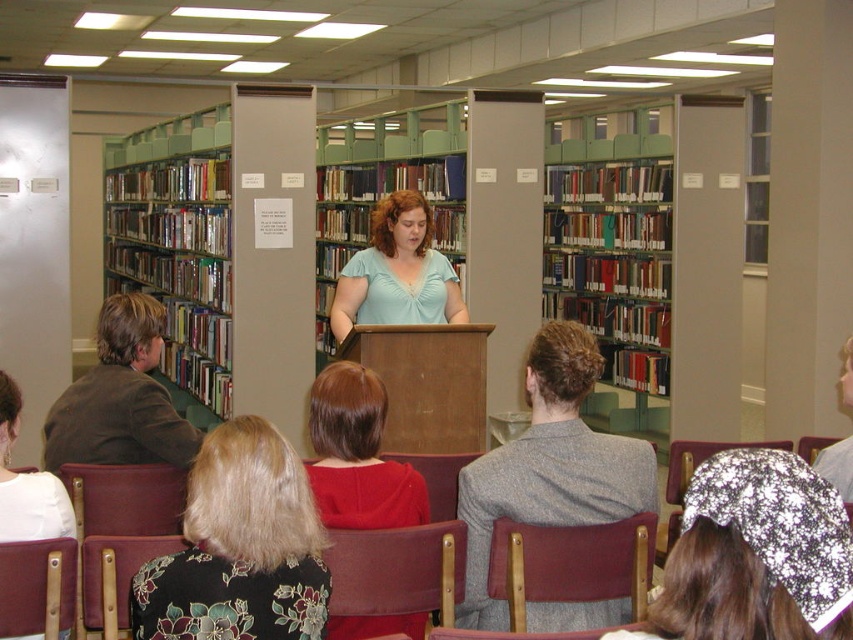
You are sitting in the floral fabric chair at lower left and want to hand a note to the person wearing the sparkly silver headscarf at lower right. Can you directly hand them the note without getting up?

The sparkly silver headscarf at lower right is in front of the floral fabric chair at lower left, so you can directly hand them the note without needing to get up.